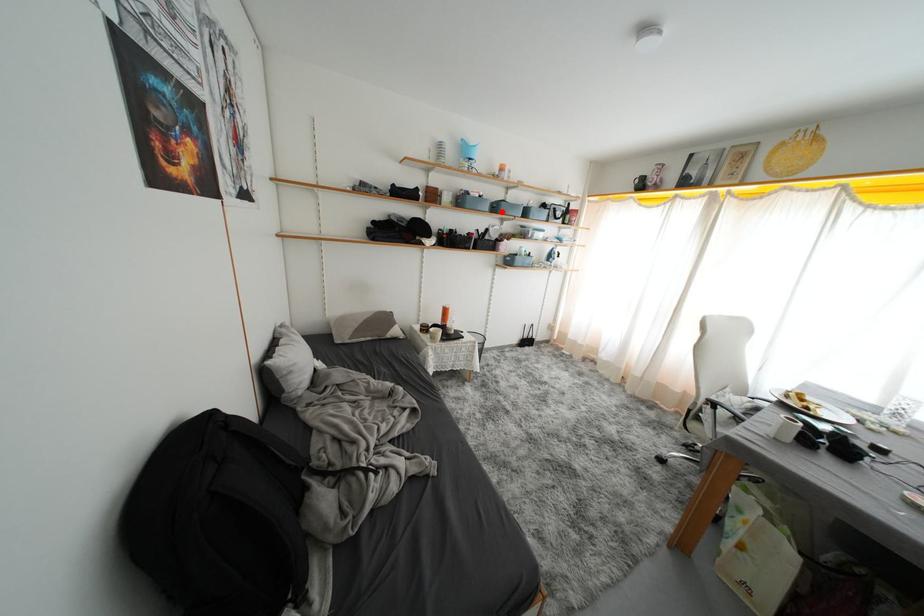
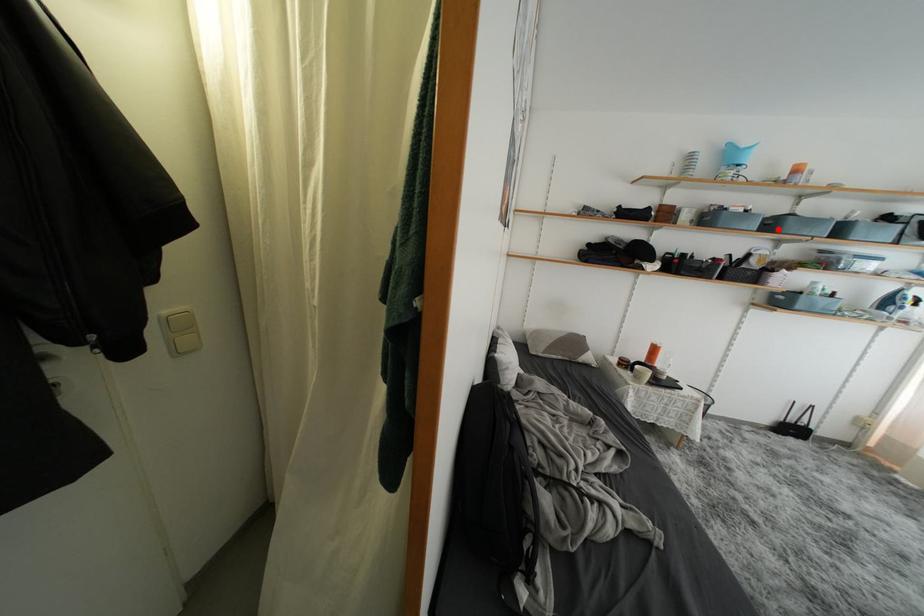
I am providing you with two images of the same scene from different viewpoints. A red point is marked on the first image and another point is marked on the second image. Do the highlighted points in image1 and image2 indicate the same real-world spot?

Yes